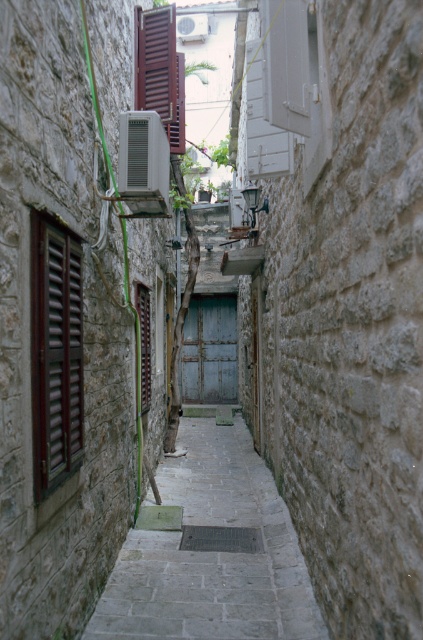
Question: Which object appears farthest from the camera in this image?

Choices:
 (A) brown wooden shutter at upper left
 (B) brown wooden shutters at left

Answer: (A)

Question: Which of the following is the closest to the observer?

Choices:
 (A) (147, 378)
 (B) (154, 83)
 (C) (205, 492)
 (D) (69, 344)

Answer: (D)

Question: Is stone paved path at center positioned at the back of brown wooden shutter at upper left?

Choices:
 (A) yes
 (B) no

Answer: (B)

Question: Based on their relative distances, which object is nearer to the brown wooden shutter at upper left?

Choices:
 (A) stone paved path at center
 (B) brown wooden shutters at left
 (C) wooden brown shutter at center

Answer: (C)

Question: Is stone paved path at center bigger than brown wooden shutters at left?

Choices:
 (A) yes
 (B) no

Answer: (B)

Question: Can you confirm if stone paved path at center is thinner than brown wooden shutters at left?

Choices:
 (A) no
 (B) yes

Answer: (A)